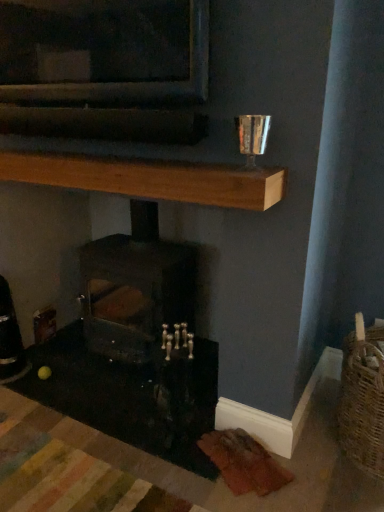
Question: Is wooden plank at upper center situated inside dark gray stone wood burning stove at center or outside?

Choices:
 (A) outside
 (B) inside

Answer: (A)

Question: In the image, is wooden plank at upper center positioned in front of or behind dark gray stone wood burning stove at center?

Choices:
 (A) behind
 (B) front

Answer: (B)

Question: In terms of width, does wooden plank at upper center look wider or thinner when compared to dark gray stone wood burning stove at center?

Choices:
 (A) thin
 (B) wide

Answer: (A)

Question: From their relative heights in the image, would you say dark gray stone wood burning stove at center is taller or shorter than wooden plank at upper center?

Choices:
 (A) short
 (B) tall

Answer: (B)

Question: Looking at the image, does dark gray stone wood burning stove at center seem bigger or smaller compared to wooden plank at upper center?

Choices:
 (A) big
 (B) small

Answer: (A)

Question: Is dark gray stone wood burning stove at center inside the boundaries of wooden plank at upper center, or outside?

Choices:
 (A) outside
 (B) inside

Answer: (A)

Question: In the image, is dark gray stone wood burning stove at center positioned in front of or behind wooden plank at upper center?

Choices:
 (A) front
 (B) behind

Answer: (B)